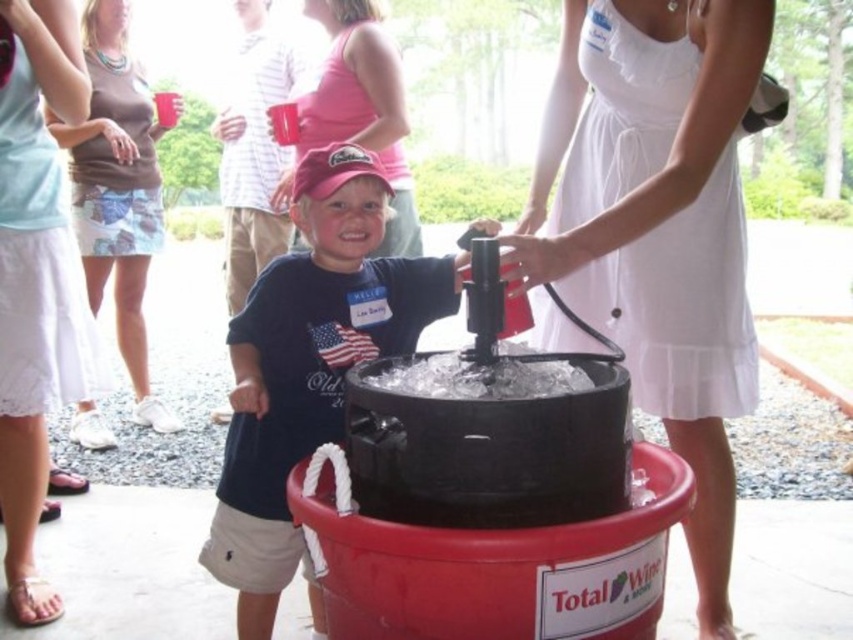
Question: Based on their relative distances, which object is nearer to the white cotton dress at center?

Choices:
 (A) brown cotton tank top at upper left
 (B) brown floral dress at upper left

Answer: (A)

Question: Can you confirm if matte black shirt at center is positioned to the right of matte pink dress at center?

Choices:
 (A) no
 (B) yes

Answer: (B)

Question: Does white cotton dress at center have a lesser width compared to brown cotton tank top at upper left?

Choices:
 (A) yes
 (B) no

Answer: (B)

Question: Can you confirm if matte pink dress at center is wider than brown floral dress at upper left?

Choices:
 (A) no
 (B) yes

Answer: (B)

Question: Estimate the real-world distances between objects in this image. Which object is closer to the brown cotton tank top at upper left?

Choices:
 (A) matte black shirt at center
 (B) white cotton dress at center

Answer: (A)

Question: Which point appears farthest from the camera in this image?

Choices:
 (A) (55, 236)
 (B) (114, 108)
 (C) (254, 515)

Answer: (B)